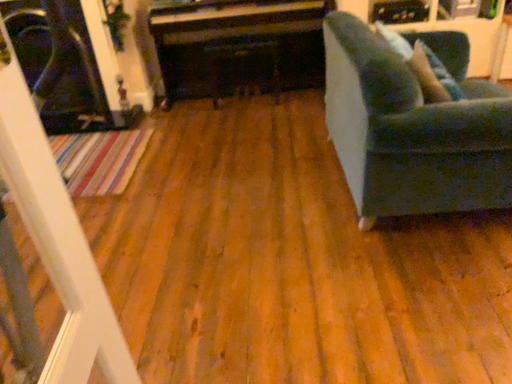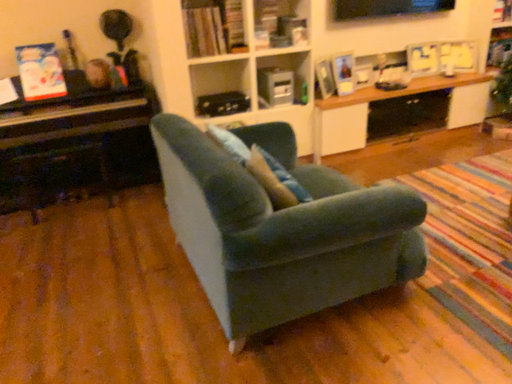
Question: Which way did the camera rotate in the video?

Choices:
 (A) rotated downward
 (B) rotated upward

Answer: (B)